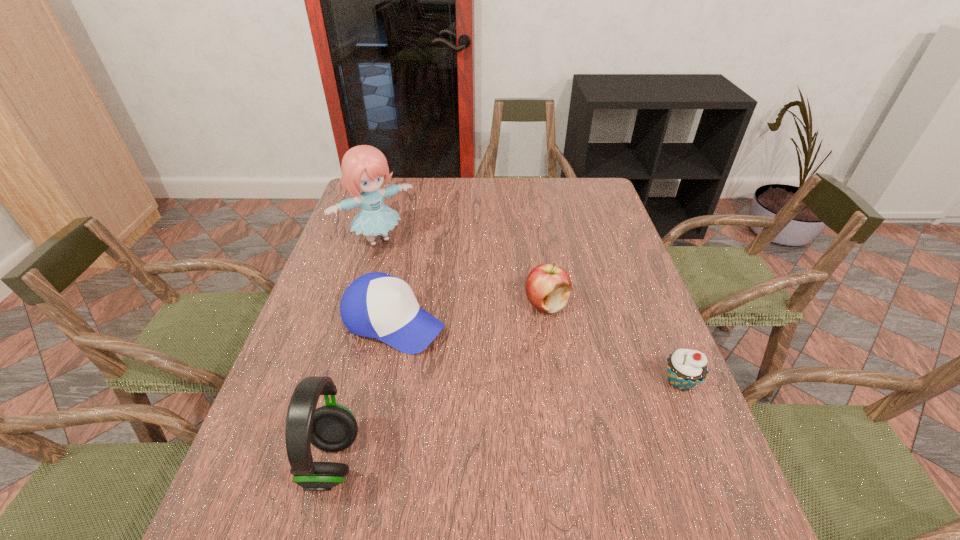
The width and height of the screenshot is (960, 540). In order to click on the nearest object in this screenshot , I will do `click(331, 428)`.

In order to click on the fourth shortest object in this screenshot , I will do 331,428.

This screenshot has width=960, height=540. Find the location of `the second nearest object`. the second nearest object is located at coordinates (686, 368).

Image resolution: width=960 pixels, height=540 pixels. What are the coordinates of `the rightmost object` in the screenshot? It's located at (686, 368).

Locate an element on the screen. The width and height of the screenshot is (960, 540). the tallest object is located at coordinates (364, 167).

At what (x,y) coordinates should I click in order to perform the action: click on doll. Please return your answer as a coordinate pair (x, y). The image size is (960, 540). Looking at the image, I should click on (364, 167).

The height and width of the screenshot is (540, 960). In order to click on baseball cap in this screenshot , I will do `click(377, 305)`.

The width and height of the screenshot is (960, 540). In order to click on the second object from right to left in this screenshot , I will do `click(548, 286)`.

This screenshot has width=960, height=540. Find the location of `vacant space located on the ear cups of the second tallest object`. vacant space located on the ear cups of the second tallest object is located at coordinates (449, 462).

Identify the location of vacant space located on the left of the cupcake. pyautogui.click(x=489, y=382).